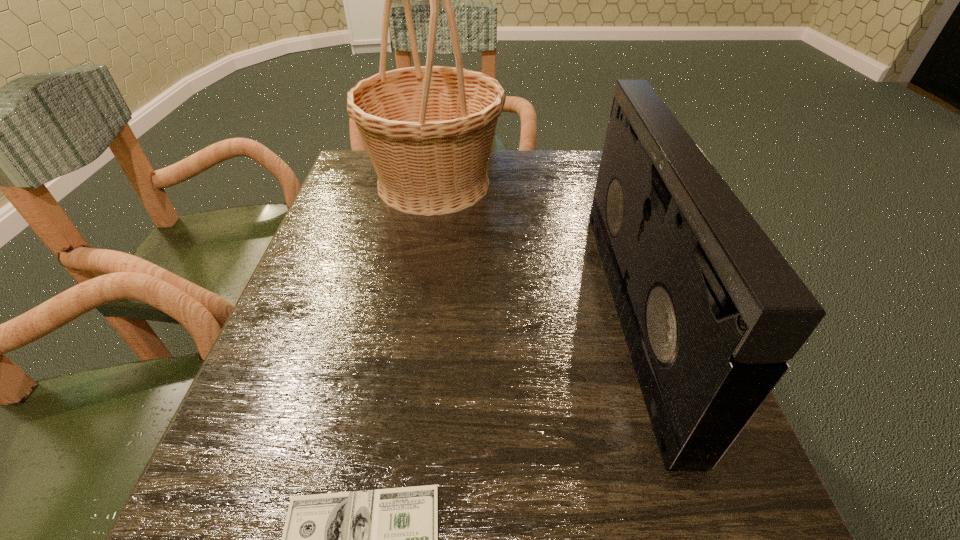
Where is `object present at the far left corner`? This screenshot has width=960, height=540. object present at the far left corner is located at coordinates (428, 130).

At what (x,y) coordinates should I click in order to perform the action: click on vacant region at the near edge of the desktop. Please return your answer as a coordinate pair (x, y). The width and height of the screenshot is (960, 540). Looking at the image, I should click on (492, 534).

At what (x,y) coordinates should I click in order to perform the action: click on vacant space at the left edge. Please return your answer as a coordinate pair (x, y). This screenshot has width=960, height=540. Looking at the image, I should click on (310, 448).

At what (x,y) coordinates should I click in order to perform the action: click on free region at the right edge of the desktop. Please return your answer as a coordinate pair (x, y). Looking at the image, I should click on (605, 279).

In the image, there is a desktop. Where is `free space at the far left corner`? The image size is (960, 540). free space at the far left corner is located at coordinates pyautogui.click(x=366, y=154).

This screenshot has width=960, height=540. What are the coordinates of `free space at the far right corner of the desktop` in the screenshot? It's located at pyautogui.click(x=550, y=151).

This screenshot has height=540, width=960. I want to click on vacant space that is in between the videotape and the tallest object, so click(534, 248).

This screenshot has width=960, height=540. What are the coordinates of `free space between the tallest object and the videotape` in the screenshot? It's located at (534, 248).

Where is `the second closest object to the tallest object`? This screenshot has width=960, height=540. the second closest object to the tallest object is located at coordinates click(x=387, y=539).

Select which object is the second closest to the basket. Please provide its 2D coordinates. Your answer should be formatted as a tuple, i.e. [(x, y)], where the tuple contains the x and y coordinates of a point satisfying the conditions above.

[(387, 539)]